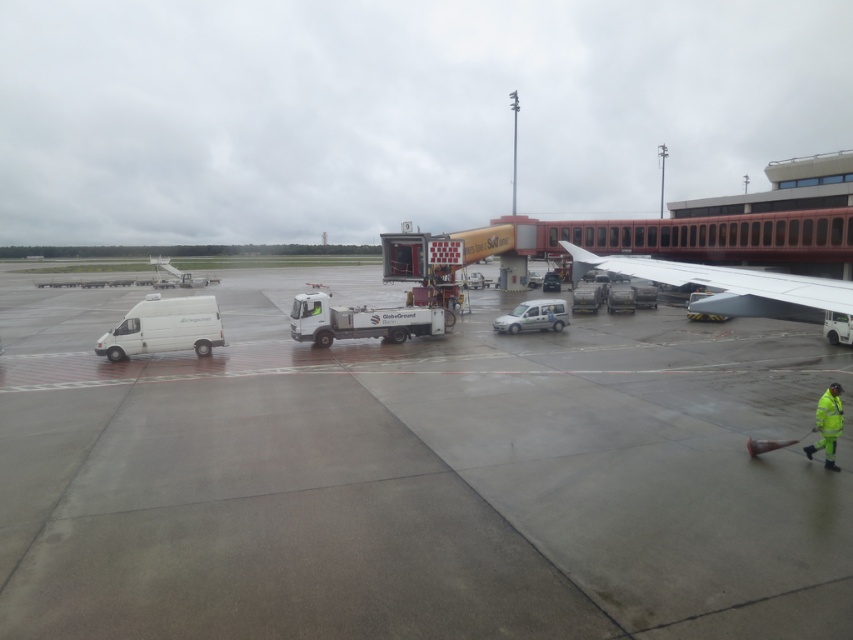
Find the location of a particular element. white matte wing at upper right is located at coordinates (734, 285).

The height and width of the screenshot is (640, 853). Describe the element at coordinates (734, 285) in the screenshot. I see `white matte wing at upper right` at that location.

Find the location of a particular element. Image resolution: width=853 pixels, height=640 pixels. white matte wing at upper right is located at coordinates pyautogui.click(x=734, y=285).

Is gray concrete tarmac at center smaller than white matte wing at upper right?

Yes.

Does gray concrete tarmac at center have a greater width compared to white matte wing at upper right?

Yes, gray concrete tarmac at center is wider than white matte wing at upper right.

You are a GUI agent. You are given a task and a screenshot of the screen. Output one action in this format:
    pyautogui.click(x=<x>, y=<y>)
    Task: Click on the gray concrete tarmac at center
    Image resolution: width=853 pixels, height=640 pixels.
    Given the screenshot: What is the action you would take?
    pyautogui.click(x=415, y=477)

Is gray concrete tarmac at center positioned before high visibility yellow jacket at lower right?

Yes, gray concrete tarmac at center is closer to the viewer.

Measure the distance from gray concrete tarmac at center to high visibility yellow jacket at lower right.

gray concrete tarmac at center is 11.95 meters away from high visibility yellow jacket at lower right.

Where is `gray concrete tarmac at center`? Image resolution: width=853 pixels, height=640 pixels. gray concrete tarmac at center is located at coordinates (415, 477).

You are a GUI agent. You are given a task and a screenshot of the screen. Output one action in this format:
    pyautogui.click(x=<x>, y=<y>)
    Task: Click on the gray concrete tarmac at center
    The image size is (853, 640).
    Given the screenshot: What is the action you would take?
    pyautogui.click(x=415, y=477)